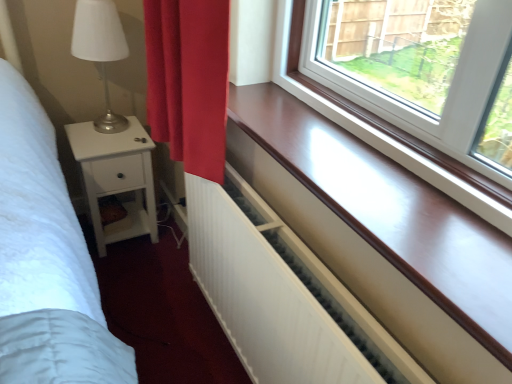
I want to click on matte silver table lamp at left, so click(100, 50).

This screenshot has width=512, height=384. What do you see at coordinates (100, 50) in the screenshot?
I see `matte silver table lamp at left` at bounding box center [100, 50].

In order to face smooth wood window sill at center, should I rotate leftwards or rightwards?

Rotate right and turn 11.436 degrees.

Where is `matte silver table lamp at left`? matte silver table lamp at left is located at coordinates (100, 50).

In the scene shown: Does white matte radiator at lower center have a greater width compared to matte silver table lamp at left?

No.

From a real-world perspective, is white matte radiator at lower center on top of matte silver table lamp at left?

No, from a real-world perspective, white matte radiator at lower center is not on top of matte silver table lamp at left.

Is white matte radiator at lower center taller or shorter than matte silver table lamp at left?

white matte radiator at lower center is taller than matte silver table lamp at left.

Which is farther from the camera, (480, 343) or (147, 207)?

Positioned behind is point (147, 207).

Which is in front, smooth wood window sill at center or white wood nightstand at left?

smooth wood window sill at center.

Which of these two, smooth wood window sill at center or white wood nightstand at left, is wider?

white wood nightstand at left.

Choose the correct answer: Is smooth wood window sill at center inside white wood nightstand at left or outside it?

smooth wood window sill at center cannot be found inside white wood nightstand at left.

Can you confirm if matte silver table lamp at left is bigger than smooth wood window sill at center?

Correct, matte silver table lamp at left is larger in size than smooth wood window sill at center.

Between matte silver table lamp at left and smooth wood window sill at center, which one is positioned in front?

smooth wood window sill at center is more forward.

From the image's perspective, who appears lower, matte silver table lamp at left or smooth wood window sill at center?

smooth wood window sill at center.

In terms of width, does matte silver table lamp at left look wider or thinner when compared to smooth wood window sill at center?

Considering their sizes, matte silver table lamp at left looks broader than smooth wood window sill at center.

Between white wood nightstand at left and matte silver table lamp at left, which one has larger width?

white wood nightstand at left.

Between white wood nightstand at left and matte silver table lamp at left, which one has smaller size?

matte silver table lamp at left.

Considering their positions, is white wood nightstand at left located in front of or behind matte silver table lamp at left?

Clearly, white wood nightstand at left is behind matte silver table lamp at left.

Could you tell me if white wood nightstand at left is facing matte silver table lamp at left?

No.

Is smooth wood window sill at center facing towards white matte radiator at lower center?

No, smooth wood window sill at center is not aimed at white matte radiator at lower center.

Does smooth wood window sill at center have a greater width compared to white matte radiator at lower center?

Correct, the width of smooth wood window sill at center exceeds that of white matte radiator at lower center.

Choose the correct answer: Is smooth wood window sill at center inside white matte radiator at lower center or outside it?

smooth wood window sill at center is not inside white matte radiator at lower center, it's outside.

From a real-world perspective, is smooth wood window sill at center physically located above or below white matte radiator at lower center?

In terms of real-world spatial position, smooth wood window sill at center is above white matte radiator at lower center.

Considering the relative sizes of smooth wood window sill at center and matte silver table lamp at left in the image provided, is smooth wood window sill at center taller than matte silver table lamp at left?

No.

Does smooth wood window sill at center have a lesser width compared to matte silver table lamp at left?

Indeed, smooth wood window sill at center has a lesser width compared to matte silver table lamp at left.

Considering the relative positions of smooth wood window sill at center and matte silver table lamp at left in the image provided, is smooth wood window sill at center behind matte silver table lamp at left?

That is False.

Is smooth wood window sill at center to the left of matte silver table lamp at left from the viewer's perspective?

In fact, smooth wood window sill at center is to the right of matte silver table lamp at left.

Where is `radiator lying behind the smooth wood window sill at center`? radiator lying behind the smooth wood window sill at center is located at coordinates pos(264,297).

Which of these two, white matte radiator at lower center or smooth wood window sill at center, is thinner?

white matte radiator at lower center is thinner.

In terms of size, does white matte radiator at lower center appear bigger or smaller than smooth wood window sill at center?

In the image, white matte radiator at lower center appears to be larger than smooth wood window sill at center.

How different are the orientations of white matte radiator at lower center and smooth wood window sill at center in degrees?

white matte radiator at lower center and smooth wood window sill at center are facing 1.17 degrees away from each other.

Where is `table lamp on the left of white matte radiator at lower center`? table lamp on the left of white matte radiator at lower center is located at coordinates point(100,50).

I want to click on window sill above the white wood nightstand at left (from the image's perspective), so click(x=391, y=212).

Based on their spatial positions, is white matte radiator at lower center or matte silver table lamp at left closer to white wood nightstand at left?

matte silver table lamp at left.

When comparing their distances from white wood nightstand at left, does matte silver table lamp at left or white matte radiator at lower center seem further?

white matte radiator at lower center lies further to white wood nightstand at left than the other object.

In the scene shown: Considering their positions, is white wood nightstand at left positioned closer to matte silver table lamp at left than white matte radiator at lower center?

white wood nightstand at left is positioned closer to the anchor matte silver table lamp at left.

Based on their spatial positions, is matte silver table lamp at left or white matte radiator at lower center closer to smooth wood window sill at center?

The object closer to smooth wood window sill at center is white matte radiator at lower center.

From the image, which object appears to be nearer to matte silver table lamp at left, white wood nightstand at left or smooth wood window sill at center?

The object closer to matte silver table lamp at left is white wood nightstand at left.

Based on their spatial positions, is smooth wood window sill at center or white wood nightstand at left further from matte silver table lamp at left?

The object further to matte silver table lamp at left is smooth wood window sill at center.

From the picture: Considering their positions, is smooth wood window sill at center positioned further to white wood nightstand at left than matte silver table lamp at left?

smooth wood window sill at center is further to white wood nightstand at left.

Estimate the real-world distances between objects in this image. Which object is further from matte silver table lamp at left, white matte radiator at lower center or smooth wood window sill at center?

The object further to matte silver table lamp at left is smooth wood window sill at center.

Locate an element on the screen. The height and width of the screenshot is (384, 512). radiator between smooth wood window sill at center and matte silver table lamp at left from front to back is located at coordinates (264, 297).

You are a GUI agent. You are given a task and a screenshot of the screen. Output one action in this format:
    pyautogui.click(x=<x>, y=<y>)
    Task: Click on the table lamp positioned between white matte radiator at lower center and white wood nightstand at left from near to far
    This screenshot has width=512, height=384.
    Given the screenshot: What is the action you would take?
    pyautogui.click(x=100, y=50)

I want to click on table lamp between smooth wood window sill at center and white wood nightstand at left in the front-back direction, so click(100, 50).

At what (x,y) coordinates should I click in order to perform the action: click on radiator positioned between smooth wood window sill at center and white wood nightstand at left from near to far. Please return your answer as a coordinate pair (x, y). This screenshot has height=384, width=512. Looking at the image, I should click on (264, 297).